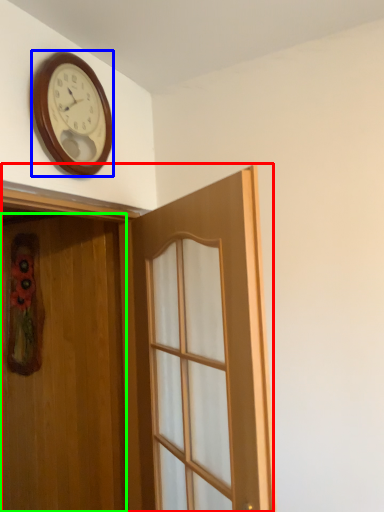
Question: Which object is the closest to the door (highlighted by a red box)? Choose among these: wall clock (highlighted by a blue box) or door (highlighted by a green box).

Choices:
 (A) wall clock
 (B) door

Answer: (B)